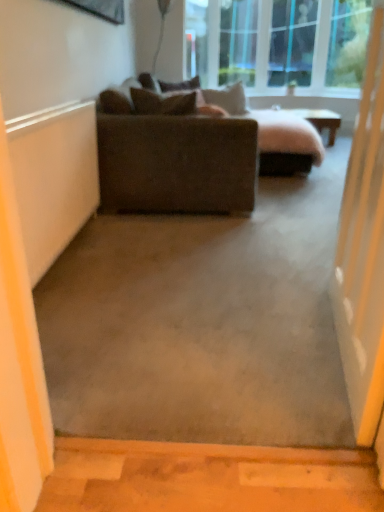
Question: From a real-world perspective, is suede-like beige pillow at upper center, which is the third pillow in front-to-back order, under suede-like brown pillow at upper center, marked as the 3th pillow in a back-to-front arrangement?

Choices:
 (A) yes
 (B) no

Answer: (A)

Question: Is suede-like brown pillow at upper center, which is counted as the second pillow, starting from the front, inside suede-like beige pillow at upper center, the 2th pillow in the back-to-front sequence?

Choices:
 (A) yes
 (B) no

Answer: (B)

Question: From the image's perspective, is suede-like beige pillow at upper center, which is the third pillow in front-to-back order, below suede-like brown pillow at upper center, which is counted as the second pillow, starting from the front?

Choices:
 (A) no
 (B) yes

Answer: (A)

Question: Is suede-like beige pillow at upper center, the 2th pillow in the back-to-front sequence, aimed at suede-like brown pillow at upper center, marked as the 3th pillow in a back-to-front arrangement?

Choices:
 (A) yes
 (B) no

Answer: (B)

Question: Does suede-like beige pillow at upper center, which is the third pillow in front-to-back order, come in front of suede-like brown pillow at upper center, marked as the 3th pillow in a back-to-front arrangement?

Choices:
 (A) yes
 (B) no

Answer: (B)

Question: Considering the positions of transparent glass screen door at right and dark brown fabric couch at center in the image, is transparent glass screen door at right bigger or smaller than dark brown fabric couch at center?

Choices:
 (A) big
 (B) small

Answer: (B)

Question: Considering the positions of transparent glass screen door at right and dark brown fabric couch at center in the image, is transparent glass screen door at right wider or thinner than dark brown fabric couch at center?

Choices:
 (A) thin
 (B) wide

Answer: (A)

Question: From a real-world perspective, is transparent glass screen door at right positioned above or below dark brown fabric couch at center?

Choices:
 (A) above
 (B) below

Answer: (A)

Question: Do you think transparent glass screen door at right is within dark brown fabric couch at center, or outside of it?

Choices:
 (A) inside
 (B) outside

Answer: (B)

Question: Considering the positions of dark brown fabric couch at center and suede-like brown pillow at upper center, which is the first pillow in back-to-front order, in the image, is dark brown fabric couch at center taller or shorter than suede-like brown pillow at upper center, which is the first pillow in back-to-front order,?

Choices:
 (A) tall
 (B) short

Answer: (A)

Question: Based on their positions, is dark brown fabric couch at center located to the left or right of suede-like brown pillow at upper center, which is the first pillow in back-to-front order?

Choices:
 (A) right
 (B) left

Answer: (A)

Question: Is dark brown fabric couch at center inside the boundaries of suede-like brown pillow at upper center, which is the first pillow in back-to-front order, or outside?

Choices:
 (A) outside
 (B) inside

Answer: (A)

Question: Based on their sizes in the image, would you say dark brown fabric couch at center is bigger or smaller than suede-like brown pillow at upper center, which is the first pillow in back-to-front order?

Choices:
 (A) small
 (B) big

Answer: (B)

Question: From the image's perspective, is suede-like brown pillow at upper center, which ranks as the 4th pillow in front-to-back order, above or below suede-like brown pillow at upper center, which is counted as the second pillow, starting from the front?

Choices:
 (A) above
 (B) below

Answer: (A)

Question: From a real-world perspective, is suede-like brown pillow at upper center, which is the first pillow in back-to-front order, physically located above or below suede-like brown pillow at upper center, marked as the 3th pillow in a back-to-front arrangement?

Choices:
 (A) below
 (B) above

Answer: (B)